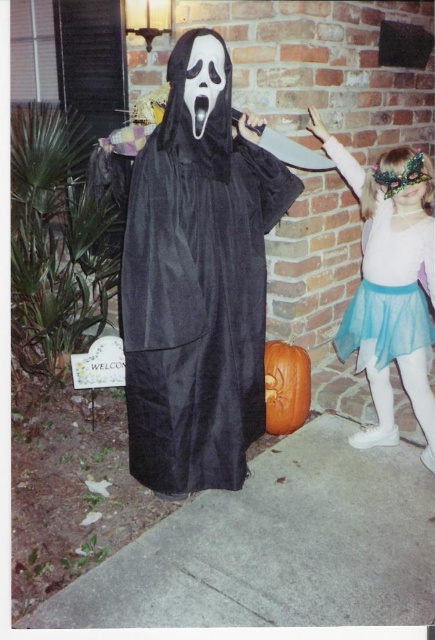
Question: Can you confirm if velvet black ghost at center is positioned to the right of light blue tulle skirt at right?

Choices:
 (A) yes
 (B) no

Answer: (B)

Question: Is light blue tulle skirt at right wider than orange matte pumpkin at center?

Choices:
 (A) yes
 (B) no

Answer: (A)

Question: Among these points, which one is farthest from the camera?

Choices:
 (A) (421, 412)
 (B) (273, 390)

Answer: (B)

Question: Is light blue tulle skirt at right to the left of orange matte pumpkin at center from the viewer's perspective?

Choices:
 (A) yes
 (B) no

Answer: (B)

Question: Which point is farther to the camera?

Choices:
 (A) (270, 413)
 (B) (424, 269)

Answer: (A)

Question: Which object is the farthest from the velvet black ghost at center?

Choices:
 (A) light blue tulle skirt at right
 (B) translucent blue skirt at right

Answer: (B)